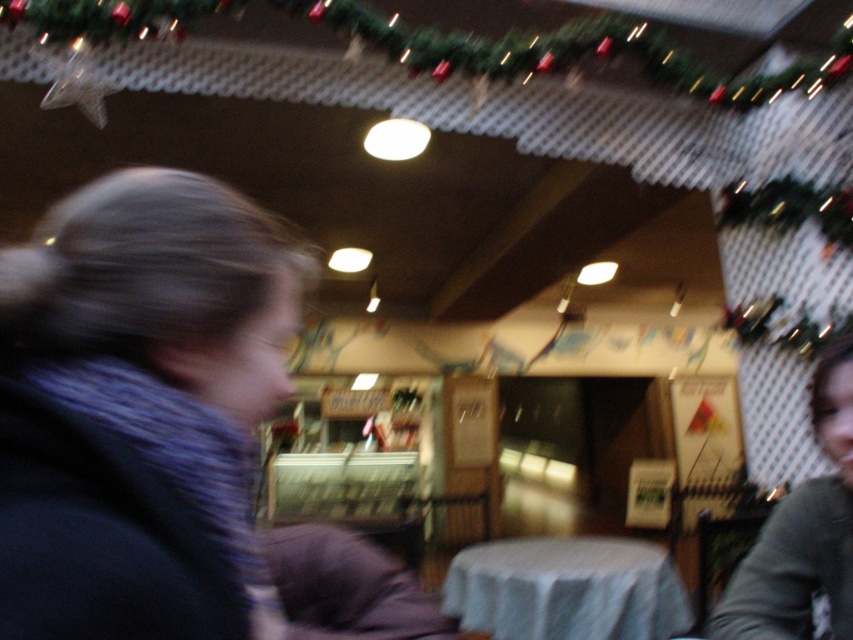
Question: Can you confirm if white cloth table at center is positioned above gray fabric shirt at lower right?

Choices:
 (A) yes
 (B) no

Answer: (B)

Question: Is white cloth table at center wider than gray fabric shirt at lower right?

Choices:
 (A) no
 (B) yes

Answer: (B)

Question: Is blue knitted scarf at left smaller than white cloth table at center?

Choices:
 (A) no
 (B) yes

Answer: (B)

Question: Which of the following is the farthest from the observer?

Choices:
 (A) white cloth table at center
 (B) blue knitted scarf at left
 (C) gray fabric shirt at lower right

Answer: (A)

Question: Which object is closer to the camera taking this photo?

Choices:
 (A) white cloth table at center
 (B) blue knitted scarf at left
 (C) gray fabric shirt at lower right

Answer: (B)

Question: Among these points, which one is nearest to the camera?

Choices:
 (A) (653, 598)
 (B) (77, 593)
 (C) (808, 552)

Answer: (B)